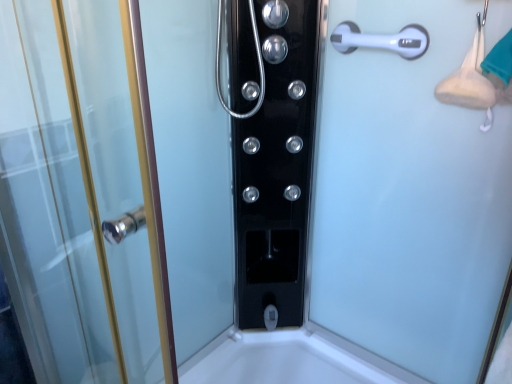
Measure the distance between point (385, 41) and camera.

Point (385, 41) and camera are 3.70 feet apart from each other.

The height and width of the screenshot is (384, 512). What do you see at coordinates (381, 40) in the screenshot?
I see `white plastic grab bar at upper right` at bounding box center [381, 40].

Measure the distance between white plastic grab bar at upper right and camera.

3.61 feet.

Image resolution: width=512 pixels, height=384 pixels. I want to click on white plastic grab bar at upper right, so (381, 40).

Locate an element on the screen. The width and height of the screenshot is (512, 384). white plastic grab bar at upper right is located at coordinates [x=381, y=40].